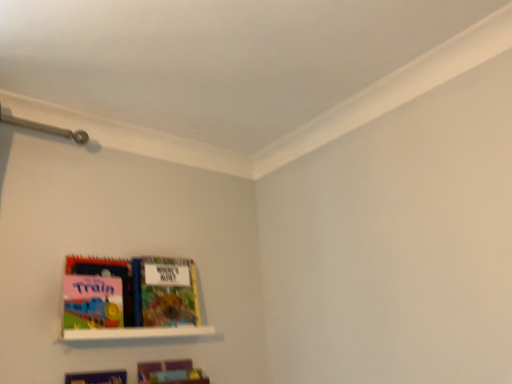
The image size is (512, 384). Identify the location of vacant space in multicolored paper book at center, marked as the second book in a bottom-to-top arrangement (from a real-world perspective). (166, 323).